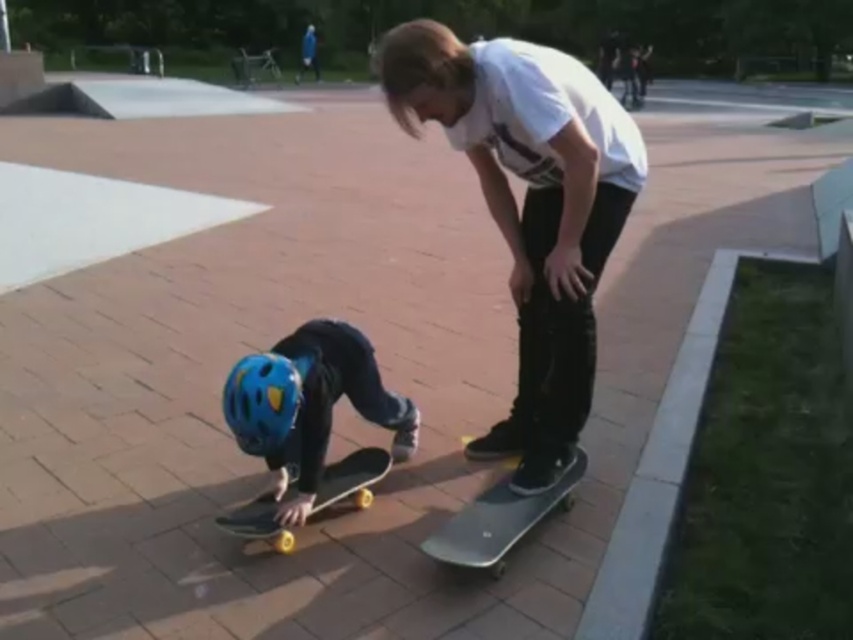
You are a photographer at the skate park and want to capture a photo of both the yellow matte skateboard at lower left and the blue matte helmet at lower center. Which object should you adjust your camera angle to include first if you need to frame them from left to right?

The blue matte helmet at lower center should be framed first since the yellow matte skateboard at lower left is to the right of it, meaning the helmet is positioned to the left of the skateboard in the scene.

You are a skateboarder who wants to choose a wider skateboard for stability. Based on the skate park scene, which skateboard should you pick between the yellow matte skateboard at lower left and the smooth gray skateboard at center?

The smooth gray skateboard at center has a greater width than the yellow matte skateboard at lower left, so you should pick the smooth gray skateboard at center for better stability.

You are a photographer setting up a tripod to capture the yellow matte skateboard at lower left. The skate park has a coordinate grid system where the bottom left corner is the origin point. If your camera is positioned at coordinates point 0.639, 0.389, will you be able to clearly see the skateboard in your shot?

The yellow matte skateboard at lower left is located at point (331, 408), so yes, the camera positioned at those coordinates will be directly at the skateboard, allowing for a clear view.